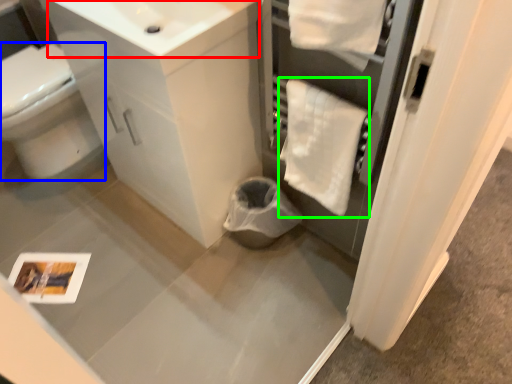
Question: Which object is positioned farthest from sink (highlighted by a red box)? Select from bidet (highlighted by a blue box) and bath towel (highlighted by a green box).

Choices:
 (A) bidet
 (B) bath towel

Answer: (A)